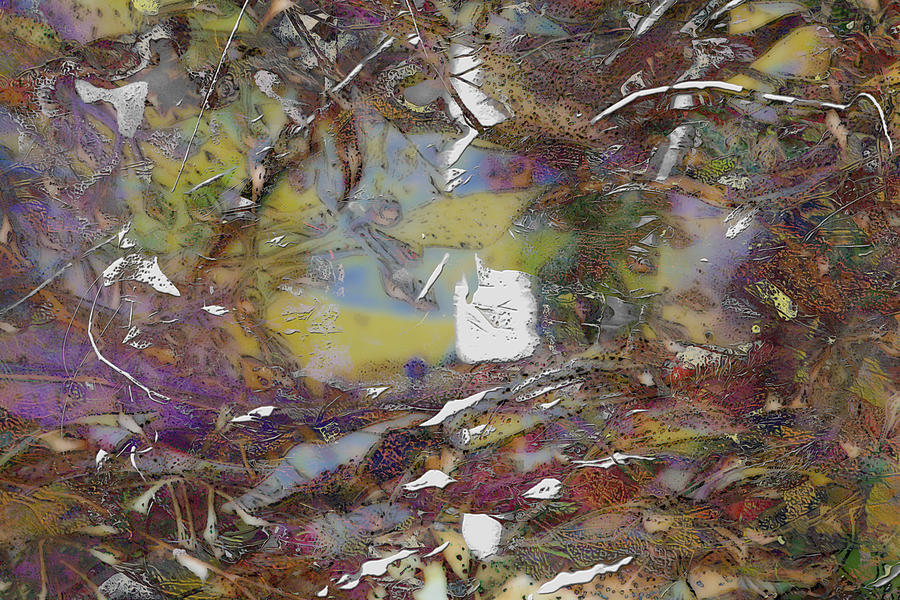
Image resolution: width=900 pixels, height=600 pixels. Identify the location of top right edge of painting. (896, 4).